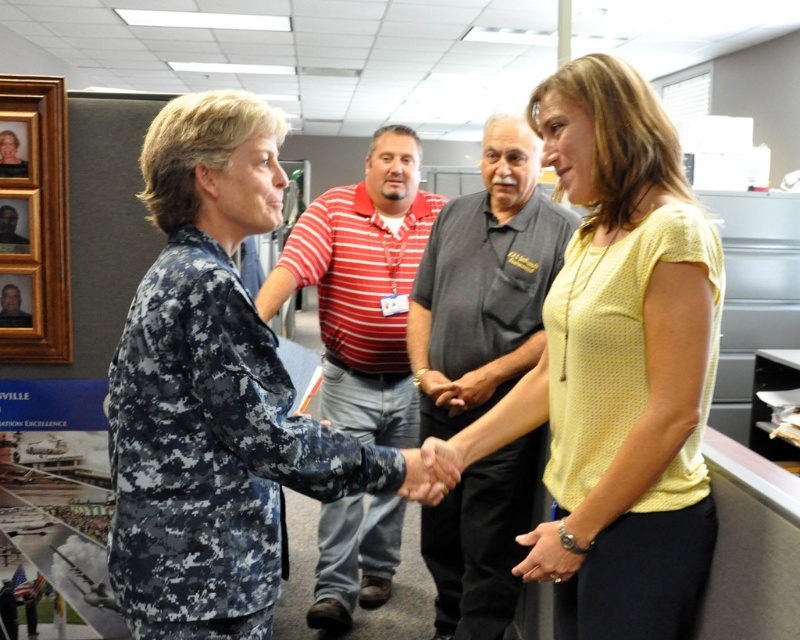
Between striped cotton shirt at center and brushed metal picture frame at upper left, which one has more height?

striped cotton shirt at center

Does point (394, 211) come behind point (4, 161)?

Yes, it is behind point (4, 161).

The width and height of the screenshot is (800, 640). Identify the location of striped cotton shirt at center. (364, 288).

Does yellow dotted blouse at center appear on the left side of brushed metal picture frame at upper left?

Incorrect, yellow dotted blouse at center is not on the left side of brushed metal picture frame at upper left.

How much distance is there between yellow dotted blouse at center and brushed metal picture frame at upper left?

yellow dotted blouse at center is 5.12 feet away from brushed metal picture frame at upper left.

Does point (613, 538) come behind point (0, 125)?

No, (613, 538) is in front of (0, 125).

Locate an element on the screen. yellow dotted blouse at center is located at coordinates (617, 368).

Does dark gray shirt at center have a greater width compared to striped cotton shirt at center?

No, dark gray shirt at center is not wider than striped cotton shirt at center.

Does dark gray shirt at center appear under striped cotton shirt at center?

Correct, dark gray shirt at center is located below striped cotton shirt at center.

Does point (528, 262) come closer to viewer compared to point (406, 406)?

Yes.

You are a GUI agent. You are given a task and a screenshot of the screen. Output one action in this format:
    pyautogui.click(x=<x>, y=<y>)
    Task: Click on the dark gray shirt at center
    
    Given the screenshot: What is the action you would take?
    pyautogui.click(x=484, y=284)